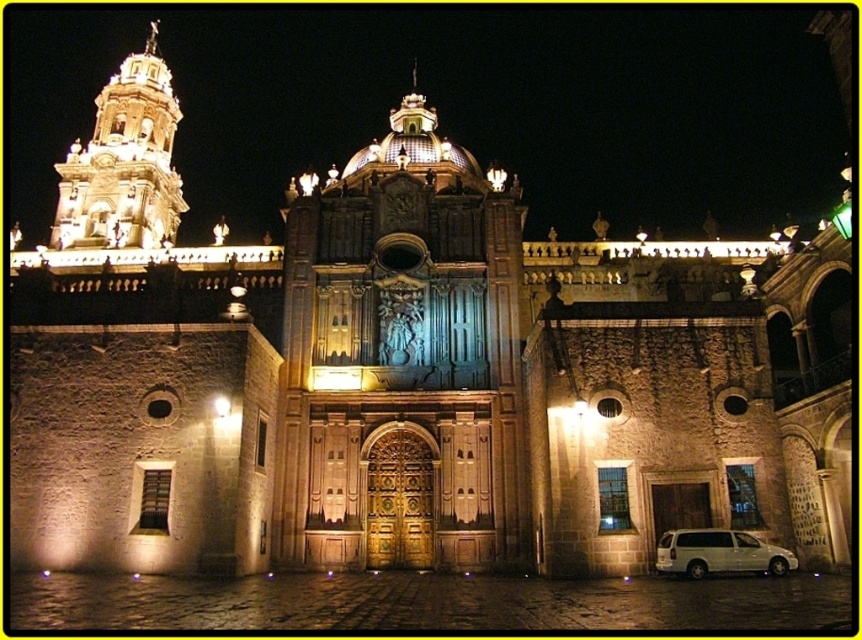
Who is more distant from viewer, (289, 540) or (95, 180)?

Positioned behind is point (95, 180).

Measure the distance from golden stone tower at center to golden stone tower at upper left.

golden stone tower at center and golden stone tower at upper left are 133.41 feet apart from each other.

Between point (517, 538) and point (142, 145), which one is positioned in front?

Point (517, 538) is in front.

At what (x,y) coordinates should I click in order to perform the action: click on golden stone tower at center. Please return your answer as a coordinate pair (x, y). The height and width of the screenshot is (640, 862). Looking at the image, I should click on (403, 360).

Who is more forward, [291,202] or [756,563]?

Point [756,563]

Does point (326, 397) come farther from viewer compared to point (785, 556)?

Yes, point (326, 397) is farther from viewer.

Find the location of a particular element. The width and height of the screenshot is (862, 640). golden stone tower at center is located at coordinates (403, 360).

Between point (138, 189) and point (717, 570), which one is positioned in front?

Point (717, 570)

Which is behind, point (169, 204) or point (736, 545)?

Positioned behind is point (169, 204).

Where is `golden stone tower at upper left`? The width and height of the screenshot is (862, 640). golden stone tower at upper left is located at coordinates (123, 163).